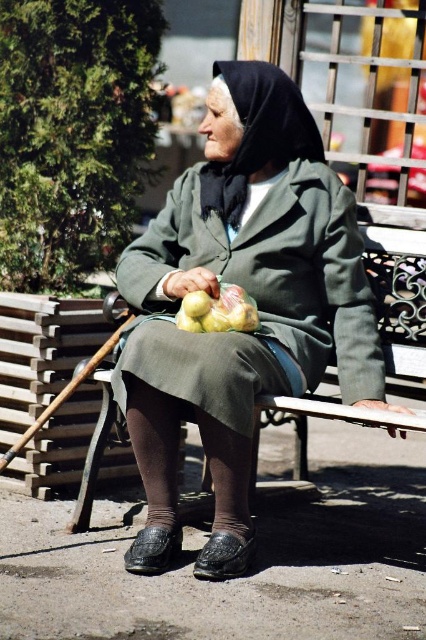
Does matte green coat at center have a larger size compared to yellow matte apples at center?

Correct, matte green coat at center is larger in size than yellow matte apples at center.

Is matte green coat at center further to the viewer compared to yellow matte apples at center?

No, matte green coat at center is in front of yellow matte apples at center.

Is point (334, 346) positioned in front of point (190, 326)?

No, (334, 346) is further to viewer.

Locate an element on the screen. Image resolution: width=426 pixels, height=640 pixels. matte green coat at center is located at coordinates (250, 294).